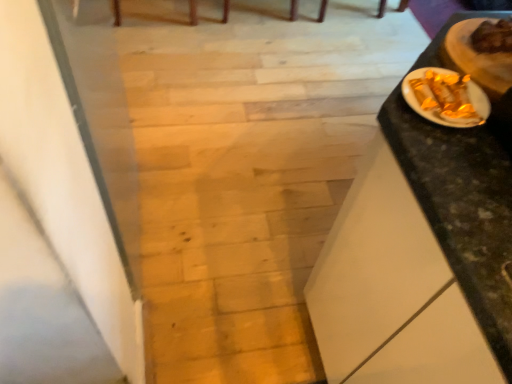
This screenshot has width=512, height=384. I want to click on free point above gold foil wrapped food at right (from a real-world perspective), so click(482, 54).